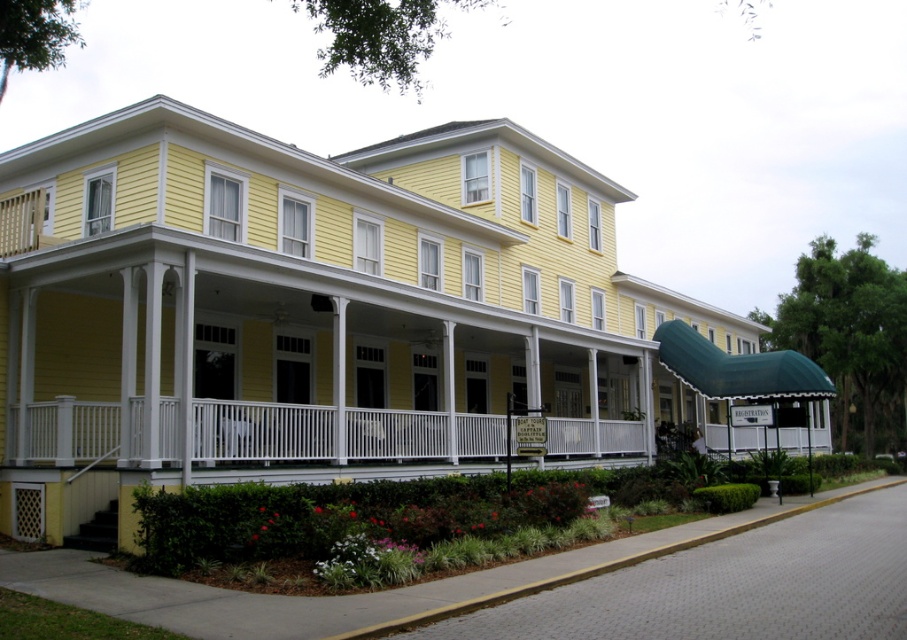
You are standing at the entrance of the building and want to walk to the white painted wood porch at center. Which direction should you move relative to your current position?

The white painted wood porch at center is located at point 0.675 along the x axis and 0.289 along the y axis, so you should move forward and to the right to reach it.

You are a gardener planning to plant a row of flowers along the edge of the yellow concrete curb at lower center. The white painted wood porch at center is above the curb. Will the flowers planted on the curb be visible from under the porch?

The white painted wood porch at center is positioned over the yellow concrete curb at lower center, so the flowers planted on the curb might not be fully visible from under the porch due to the porch structure blocking the view.